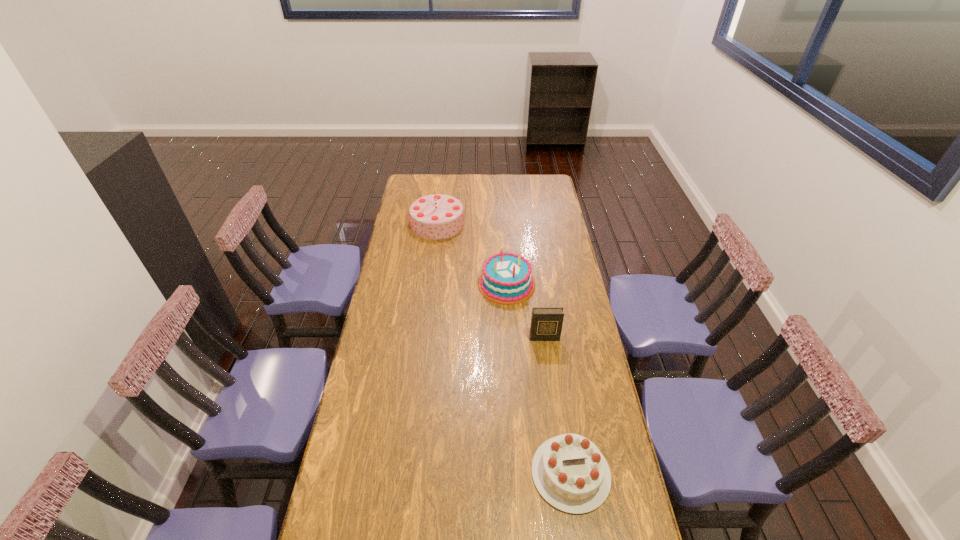
I want to click on vacant space located on the back of the nearest object, so click(553, 354).

At what (x,y) coordinates should I click in order to perform the action: click on object at the left edge. Please return your answer as a coordinate pair (x, y). The image size is (960, 540). Looking at the image, I should click on (437, 216).

Find the location of a particular element. This screenshot has width=960, height=540. diary located in the right edge section of the desktop is located at coordinates (546, 323).

Locate an element on the screen. This screenshot has width=960, height=540. birthday cake that is at the right edge is located at coordinates (571, 474).

Find the location of a particular element. The width and height of the screenshot is (960, 540). free space at the far edge of the desktop is located at coordinates (434, 183).

Identify the location of vacant space at the left edge. (406, 270).

In the image, there is a desktop. Where is `free space at the right edge`? The width and height of the screenshot is (960, 540). free space at the right edge is located at coordinates (557, 244).

I want to click on vacant region at the far left corner of the desktop, so click(416, 179).

In order to click on unoccupied position between the third nearest object and the farthest birthday cake in this screenshot , I will do `click(472, 254)`.

This screenshot has width=960, height=540. I want to click on vacant space that is in between the nearest birthday cake and the diary, so click(558, 406).